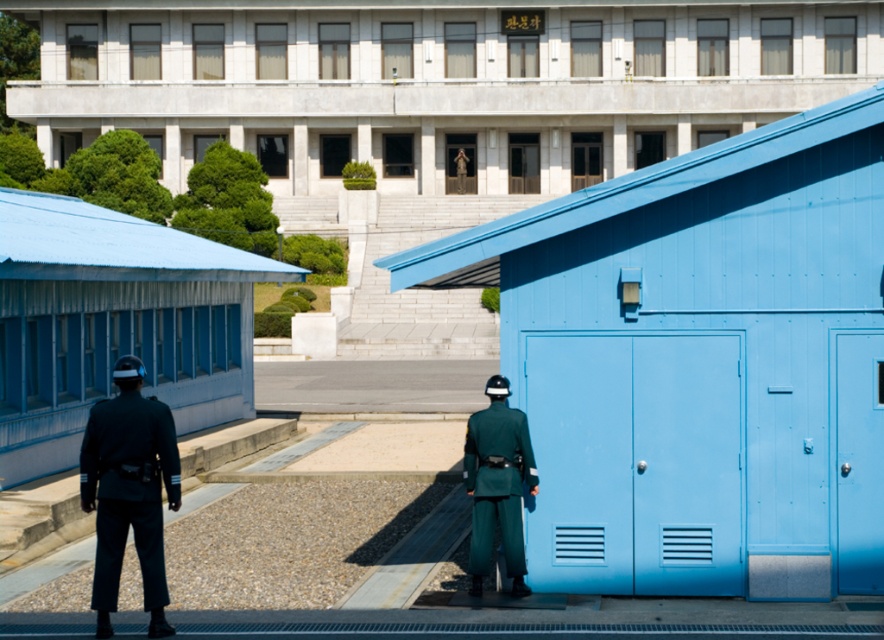
What do you see at coordinates (700, 362) in the screenshot?
I see `blue wooden hut at center-right` at bounding box center [700, 362].

Who is more forward, (646,429) or (463,458)?

Point (646,429) is in front.

Identify the location of blue wooden hut at center-right. The height and width of the screenshot is (640, 884). (700, 362).

Between dark green fabric uniform at left and green matte uniform at center, which one appears on the left side from the viewer's perspective?

dark green fabric uniform at left is more to the left.

The height and width of the screenshot is (640, 884). What do you see at coordinates (128, 490) in the screenshot?
I see `dark green fabric uniform at left` at bounding box center [128, 490].

At what (x,y) coordinates should I click in order to perform the action: click on dark green fabric uniform at left. Please return your answer as a coordinate pair (x, y). Image resolution: width=884 pixels, height=640 pixels. Looking at the image, I should click on (128, 490).

Is blue corrugated metal hut at center to the left of matte blue hut at left from the viewer's perspective?

In fact, blue corrugated metal hut at center is to the right of matte blue hut at left.

Can you confirm if blue corrugated metal hut at center is positioned above matte blue hut at left?

Correct, blue corrugated metal hut at center is located above matte blue hut at left.

I want to click on blue corrugated metal hut at center, so click(431, 108).

This screenshot has width=884, height=640. In order to click on blue corrugated metal hut at center in this screenshot , I will do `click(431, 108)`.